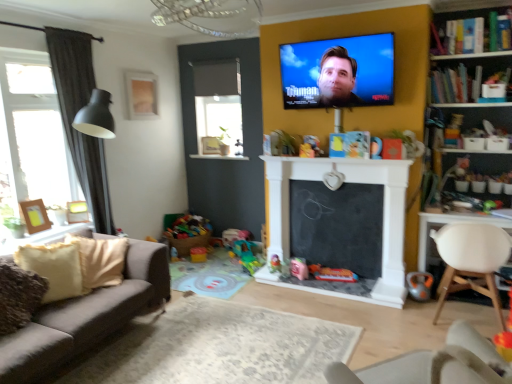
Locate an element on the screen. vacant area in front of metallic orange toy at lower right, the 1th toy in the front-to-back sequence is located at coordinates (428, 304).